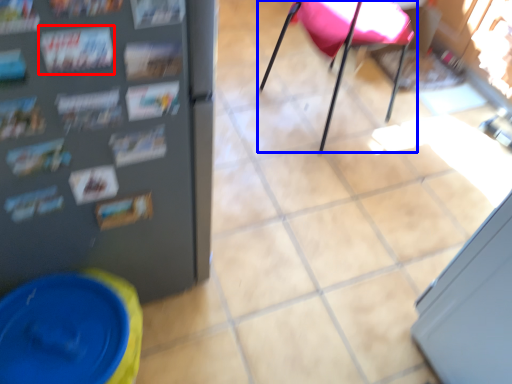
Question: Which of the following is the closest to the observer, magazine (highlighted by a red box) or chair (highlighted by a blue box)?

Choices:
 (A) magazine
 (B) chair

Answer: (A)